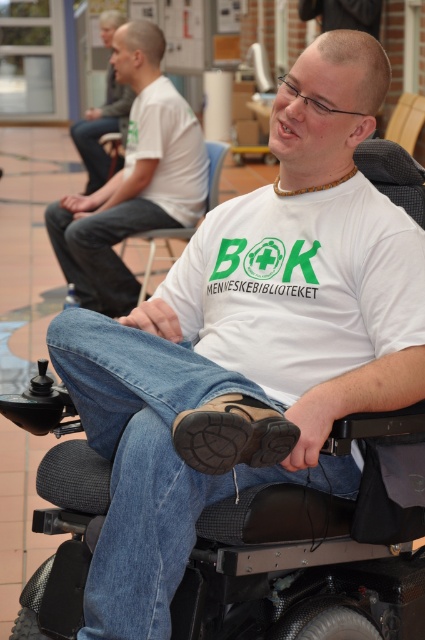
Question: Which of the following is the closest to the observer?

Choices:
 (A) blue fabric chair at center
 (B) matte white wheelchair at center
 (C) black rubber mobility scooter at lower center

Answer: (C)

Question: Can you confirm if black rubber mobility scooter at lower center is positioned below light brown leather jacket at upper left?

Choices:
 (A) yes
 (B) no

Answer: (A)

Question: Which point is farther from the camera taking this photo?

Choices:
 (A) click(x=246, y=611)
 (B) click(x=90, y=221)
 (C) click(x=153, y=234)

Answer: (C)

Question: Can you confirm if light brown leather jacket at upper left is positioned to the left of blue fabric chair at center?

Choices:
 (A) no
 (B) yes

Answer: (B)

Question: Does matte white wheelchair at center have a larger size compared to blue fabric chair at center?

Choices:
 (A) yes
 (B) no

Answer: (A)

Question: Considering the real-world distances, which object is closest to the matte white wheelchair at center?

Choices:
 (A) light brown leather jacket at upper left
 (B) blue fabric chair at center

Answer: (B)